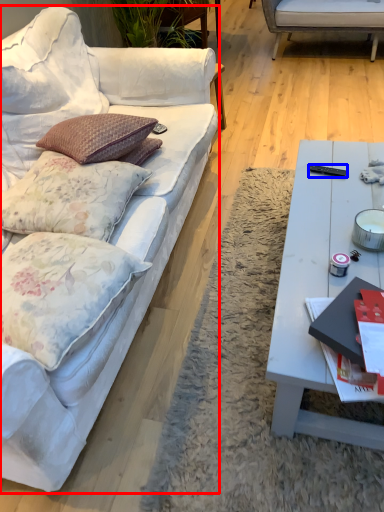
Question: Which object appears closest to the camera in this image, studio couch (highlighted by a red box) or remote control (highlighted by a blue box)?

Choices:
 (A) studio couch
 (B) remote control

Answer: (A)